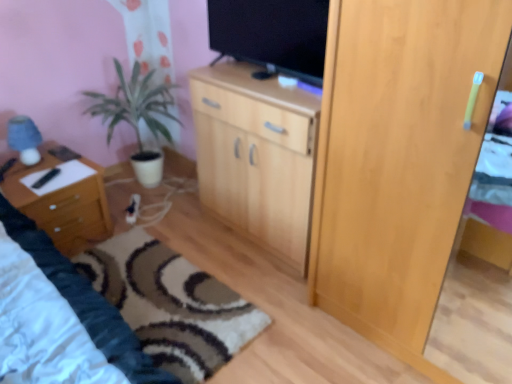
Question: From a real-world perspective, is wooden cabinet at center below light wood cupboard at right?

Choices:
 (A) yes
 (B) no

Answer: (A)

Question: Considering the relative positions of wooden cabinet at center and light wood cupboard at right in the image provided, is wooden cabinet at center to the left of light wood cupboard at right from the viewer's perspective?

Choices:
 (A) no
 (B) yes

Answer: (B)

Question: Does wooden cabinet at center turn towards light wood cupboard at right?

Choices:
 (A) no
 (B) yes

Answer: (A)

Question: Is wooden cabinet at center oriented away from light wood cupboard at right?

Choices:
 (A) no
 (B) yes

Answer: (A)

Question: Is the depth of wooden cabinet at center less than that of light wood cupboard at right?

Choices:
 (A) yes
 (B) no

Answer: (B)

Question: Is wooden nightstand at left spatially inside black glossy tv at upper center, or outside of it?

Choices:
 (A) inside
 (B) outside

Answer: (B)

Question: Considering their positions, is wooden nightstand at left located in front of or behind black glossy tv at upper center?

Choices:
 (A) behind
 (B) front

Answer: (A)

Question: Considering the relative positions of wooden nightstand at left and black glossy tv at upper center in the image provided, is wooden nightstand at left to the left or to the right of black glossy tv at upper center?

Choices:
 (A) left
 (B) right

Answer: (A)

Question: From the image's perspective, is wooden nightstand at left above or below black glossy tv at upper center?

Choices:
 (A) above
 (B) below

Answer: (B)

Question: Considering their positions, is wooden cabinet at center located in front of or behind carpet with swirl pattern at lower center?

Choices:
 (A) behind
 (B) front

Answer: (A)

Question: Visually, is wooden cabinet at center positioned to the left or to the right of carpet with swirl pattern at lower center?

Choices:
 (A) right
 (B) left

Answer: (A)

Question: Is wooden cabinet at center spatially inside carpet with swirl pattern at lower center, or outside of it?

Choices:
 (A) inside
 (B) outside

Answer: (B)

Question: In terms of height, does wooden cabinet at center look taller or shorter compared to carpet with swirl pattern at lower center?

Choices:
 (A) tall
 (B) short

Answer: (A)

Question: Is point (148, 76) closer or farther from the camera than point (90, 185)?

Choices:
 (A) farther
 (B) closer

Answer: (A)

Question: In terms of size, does green matte plant at left appear bigger or smaller than wooden nightstand at left?

Choices:
 (A) small
 (B) big

Answer: (B)